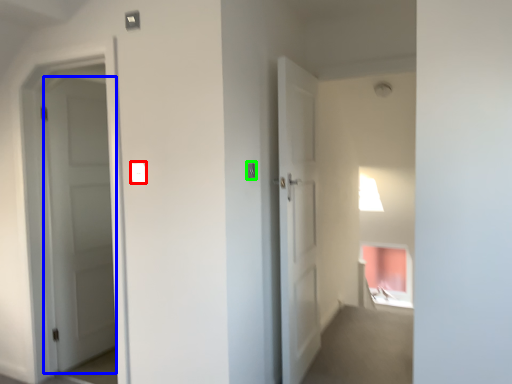
Question: Which object is the farthest from light switch (highlighted by a red box)? Choose among these: door (highlighted by a blue box) or light switch (highlighted by a green box).

Choices:
 (A) door
 (B) light switch

Answer: (A)